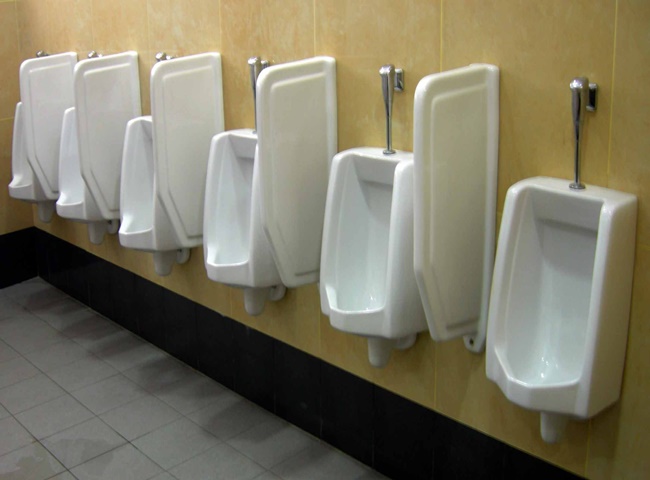
The height and width of the screenshot is (480, 650). Identify the location of dividers. (456, 154), (273, 110), (177, 89), (96, 85), (36, 88).